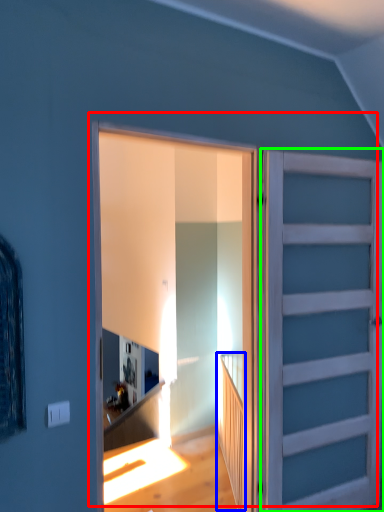
Question: Which is nearer to the door (highlighted by a red box)? stairwell (highlighted by a blue box) or door (highlighted by a green box).

Choices:
 (A) stairwell
 (B) door

Answer: (B)